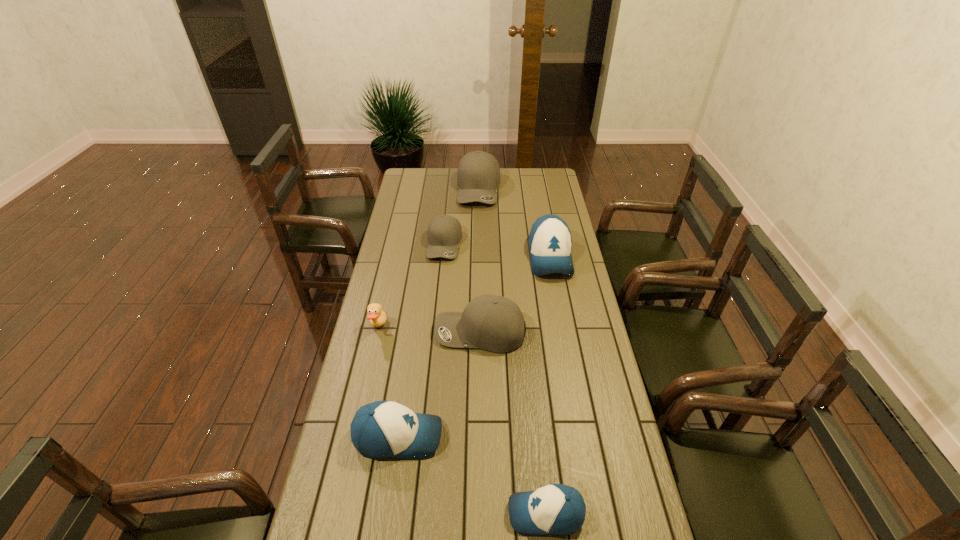
The width and height of the screenshot is (960, 540). What are the coordinates of `the shortest baseball cap` in the screenshot? It's located at (557, 509).

This screenshot has height=540, width=960. What are the coordinates of `vacant position located on the front brim of the farthest object` in the screenshot? It's located at (479, 237).

Locate an element on the screen. Image resolution: width=960 pixels, height=540 pixels. vacant space located 0.350m on the front-facing side of the biggest blue baseball cap is located at coordinates (567, 350).

Find the location of `vacant space located on the front brim of the fourth farthest baseball cap`. vacant space located on the front brim of the fourth farthest baseball cap is located at coordinates (405, 333).

You are a GUI agent. You are given a task and a screenshot of the screen. Output one action in this format:
    pyautogui.click(x=<x>, y=<y>)
    Task: Click on the free space located 0.210m on the front brim of the fourth farthest baseball cap
    The height and width of the screenshot is (540, 960).
    Given the screenshot: What is the action you would take?
    pyautogui.click(x=378, y=333)

At what (x,y) coordinates should I click in order to perform the action: click on free space located on the front brim of the fourth farthest baseball cap. Please return your answer as a coordinate pair (x, y). Looking at the image, I should click on (380, 333).

The height and width of the screenshot is (540, 960). In order to click on vacant region located 0.300m on the front-facing side of the second nearest baseball cap in this screenshot , I will do coord(543,436).

Where is `free point located 0.160m on the front brim of the smallest gray baseball cap`? free point located 0.160m on the front brim of the smallest gray baseball cap is located at coordinates (441, 288).

I want to click on vacant area situated on the beak of the duck, so click(x=416, y=327).

The height and width of the screenshot is (540, 960). Find the location of `vacant region located 0.240m on the front-facing side of the nearest object`. vacant region located 0.240m on the front-facing side of the nearest object is located at coordinates (416, 514).